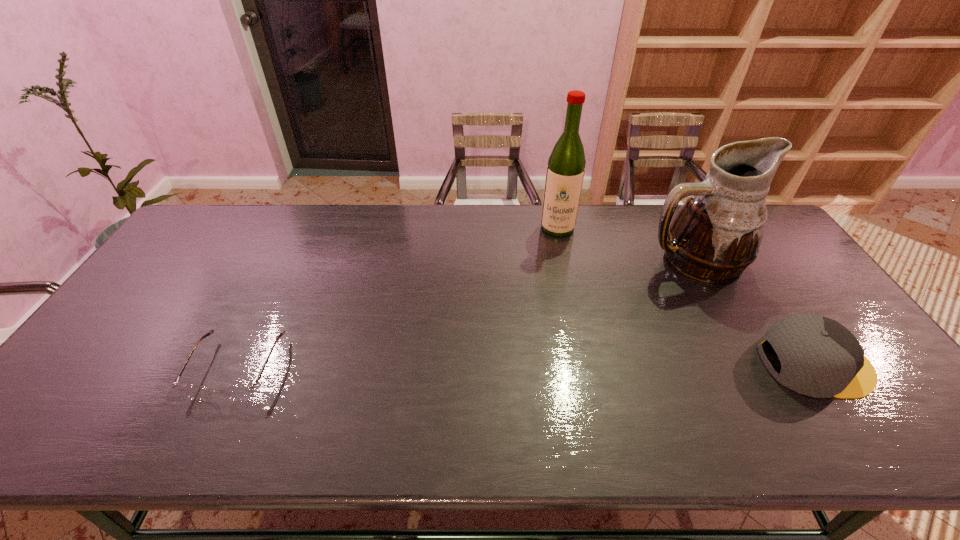
This screenshot has height=540, width=960. What are the coordinates of `free space at the far left corner of the desktop` in the screenshot? It's located at (218, 210).

You are a GUI agent. You are given a task and a screenshot of the screen. Output one action in this format:
    pyautogui.click(x=<x>, y=<y>)
    Task: Click on the vacant space at the near left corner
    The image size is (960, 540).
    Given the screenshot: What is the action you would take?
    tap(69, 388)

This screenshot has height=540, width=960. Find the location of `free space at the near right corner of the desktop`. free space at the near right corner of the desktop is located at coordinates (899, 397).

Identify the location of free space between the shortest object and the third object from right to left. (397, 298).

Identify the location of free space between the cap and the liquor. (686, 296).

You are a GUI agent. You are given a task and a screenshot of the screen. Output one action in this format:
    pyautogui.click(x=<x>, y=<y>)
    Task: Click on the vacant space that is in between the second tallest object and the third tallest object
    Image resolution: width=960 pixels, height=540 pixels.
    Given the screenshot: What is the action you would take?
    pyautogui.click(x=754, y=312)

The image size is (960, 540). Identify the location of vacant area that lies between the pitcher and the shortest object. (465, 315).

This screenshot has width=960, height=540. Find the location of `empty space that is in between the liquor and the spectacles`. empty space that is in between the liquor and the spectacles is located at coordinates (397, 298).

Locate an element on the screen. vacant area that lies between the second tallest object and the liquor is located at coordinates (625, 244).

At what (x,y) coordinates should I click in order to perform the action: click on empty space between the cap and the liquor. Please return your answer as a coordinate pair (x, y). The width and height of the screenshot is (960, 540). Looking at the image, I should click on [x=686, y=296].